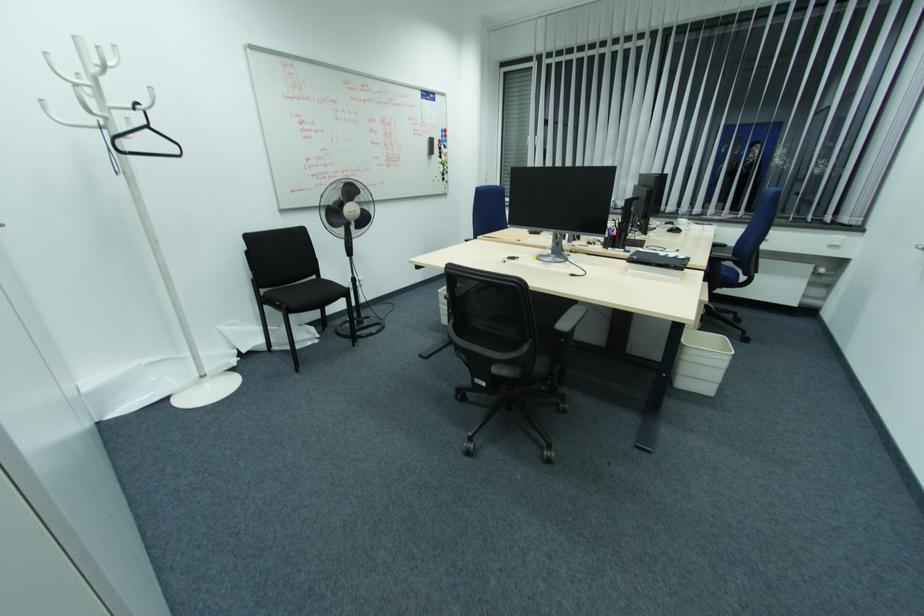
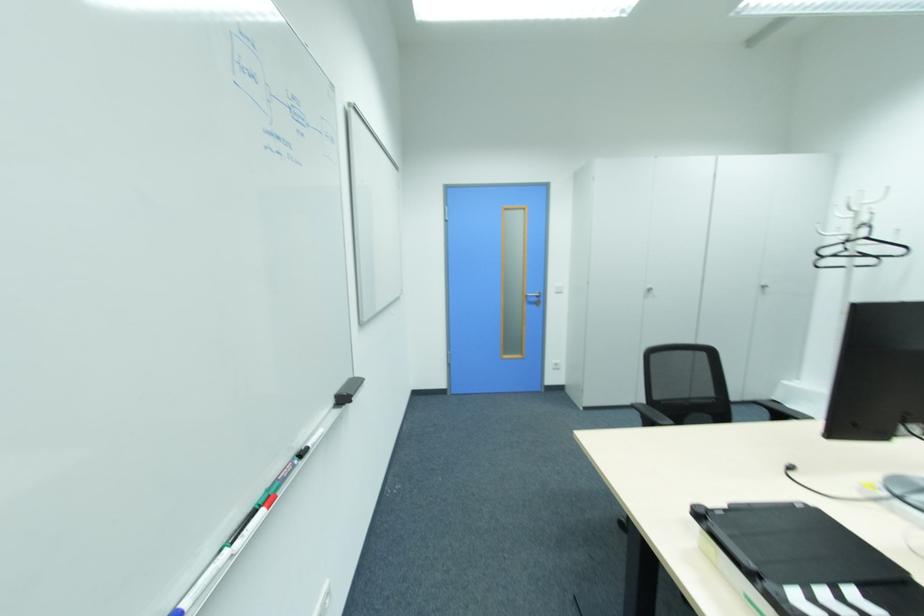
Locate, in the second image, the point that corresponds to pixel 149 128 in the first image.

(865, 238)